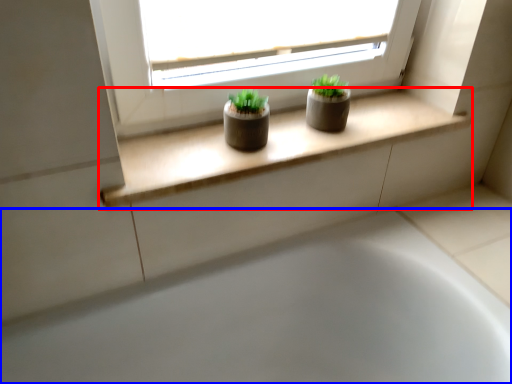
Question: Which object is further to the camera taking this photo, window sill (highlighted by a red box) or bathtub (highlighted by a blue box)?

Choices:
 (A) window sill
 (B) bathtub

Answer: (A)